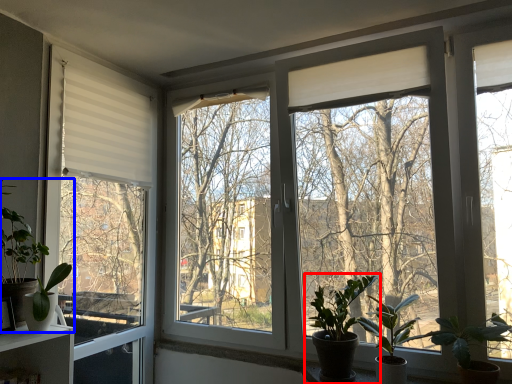
Question: Which point is closer to the camera, houseplant (highlighted by a red box) or houseplant (highlighted by a blue box)?

Choices:
 (A) houseplant
 (B) houseplant

Answer: (B)